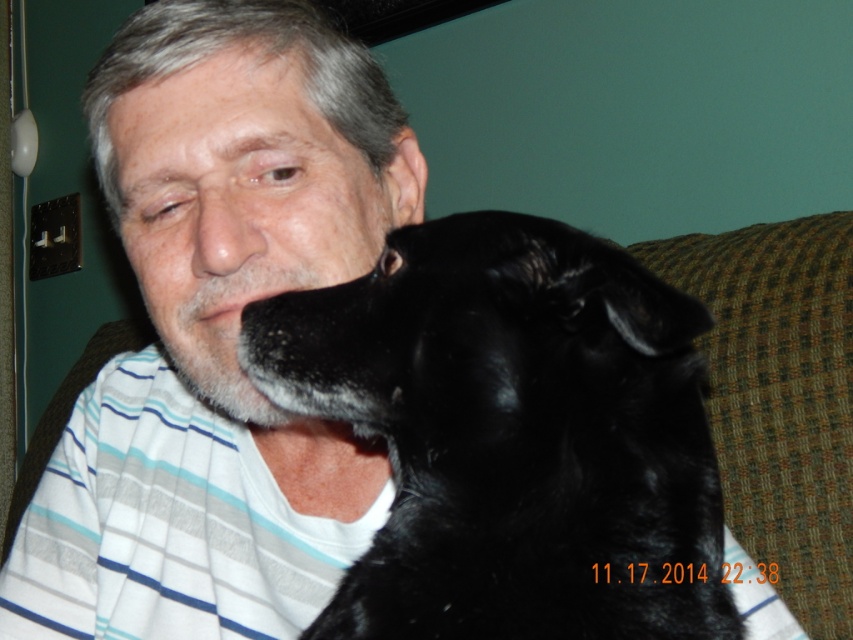
Question: Does black fur dog at left have a smaller size compared to matte black face at center?

Choices:
 (A) yes
 (B) no

Answer: (A)

Question: Is black fur dog at left above matte black face at center?

Choices:
 (A) no
 (B) yes

Answer: (A)

Question: Which point is closer to the camera?

Choices:
 (A) (358, 243)
 (B) (578, 236)

Answer: (B)

Question: Is black fur dog at left above matte black face at center?

Choices:
 (A) no
 (B) yes

Answer: (A)